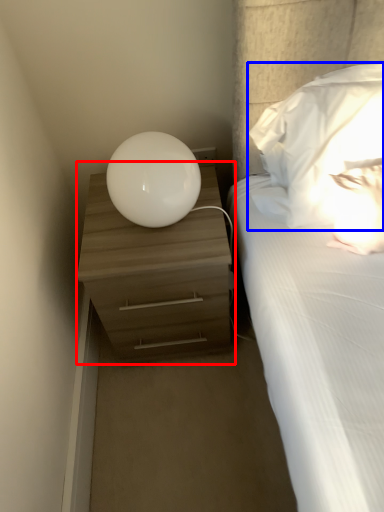
Question: Which object is closer to the camera taking this photo, nightstand (highlighted by a red box) or pillow (highlighted by a blue box)?

Choices:
 (A) nightstand
 (B) pillow

Answer: (B)